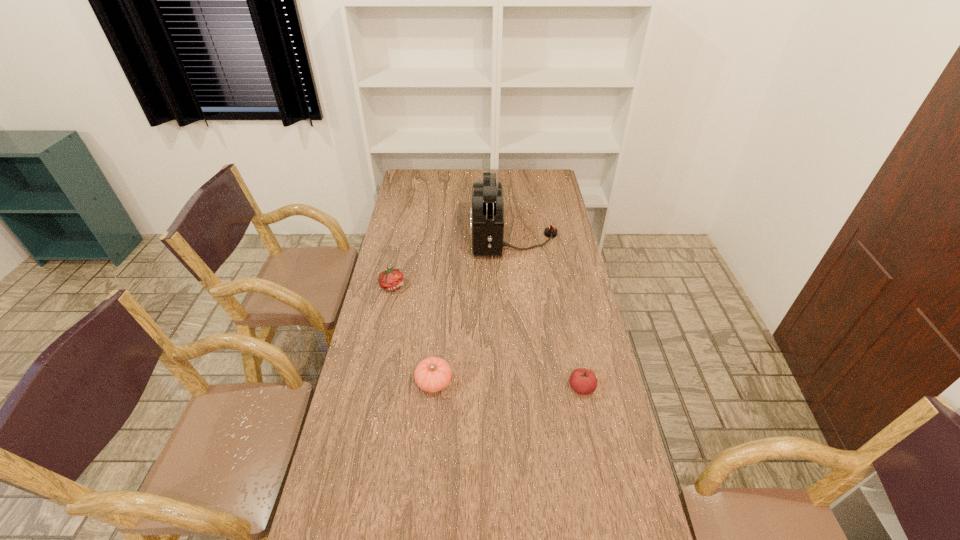
The height and width of the screenshot is (540, 960). I want to click on free point between the leftmost tomato and the rightmost tomato, so click(x=487, y=336).

Find the location of a particular element. This screenshot has height=540, width=960. empty location between the rightmost tomato and the farthest tomato is located at coordinates (487, 336).

The height and width of the screenshot is (540, 960). What are the coordinates of `vacant area that lies between the leftmost tomato and the tallest object` in the screenshot? It's located at (453, 261).

The height and width of the screenshot is (540, 960). I want to click on free area in between the rightmost tomato and the leftmost tomato, so click(487, 336).

The image size is (960, 540). I want to click on unoccupied position between the second farthest object and the second tomato from left to right, so point(413,334).

Find the location of a particular element. The width and height of the screenshot is (960, 540). unoccupied area between the third object from right to left and the leftmost tomato is located at coordinates [413, 334].

At what (x,y) coordinates should I click in order to perform the action: click on vacant point located between the farthest tomato and the farthest object. Please return your answer as a coordinate pair (x, y). This screenshot has height=540, width=960. Looking at the image, I should click on point(453,261).

The width and height of the screenshot is (960, 540). In order to click on vacant area between the third object from right to left and the leftmost tomato in this screenshot , I will do `click(413, 334)`.

Where is `free space between the leftmost object and the rightmost tomato`? This screenshot has height=540, width=960. free space between the leftmost object and the rightmost tomato is located at coordinates (487, 336).

Find the location of a particular element. the third closest object to the leftmost tomato is located at coordinates (583, 381).